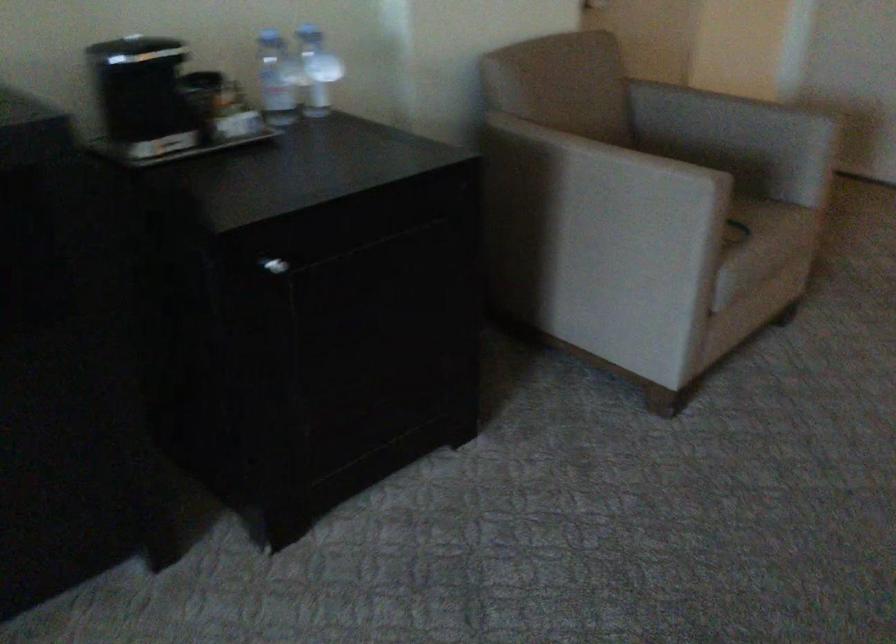
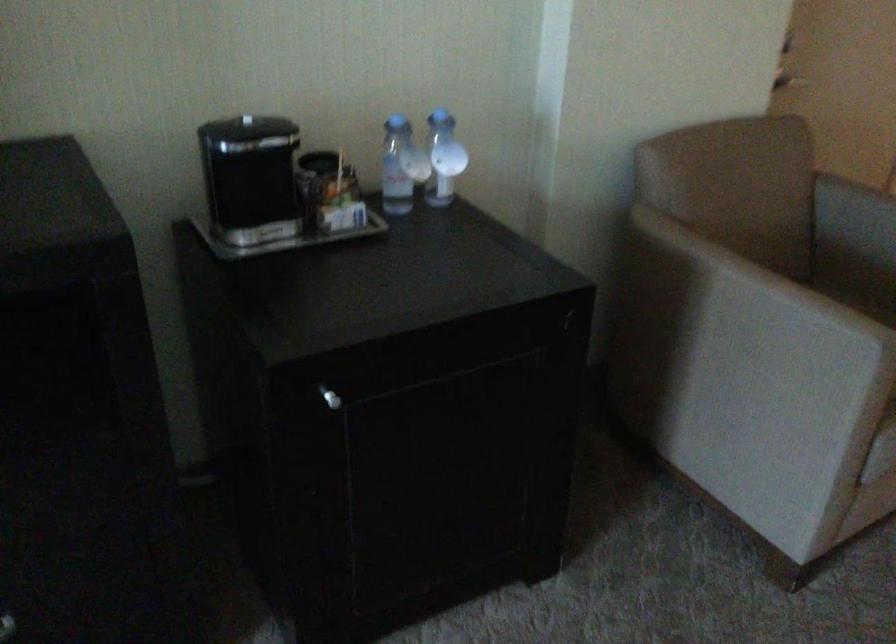
Where in the second image is the point corresponding to the point at 276,266 from the first image?

(330, 398)